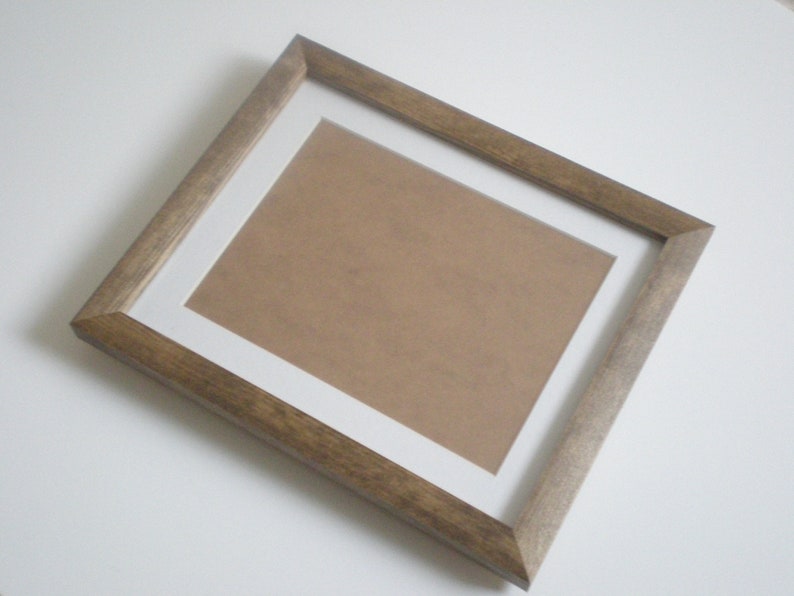
Find the location of a particular element. The width and height of the screenshot is (794, 596). corner of white mat is located at coordinates (305, 74), (660, 241), (511, 524), (126, 311).